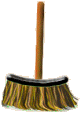
Where is `broomstick`? Image resolution: width=80 pixels, height=114 pixels. broomstick is located at coordinates (38, 38).